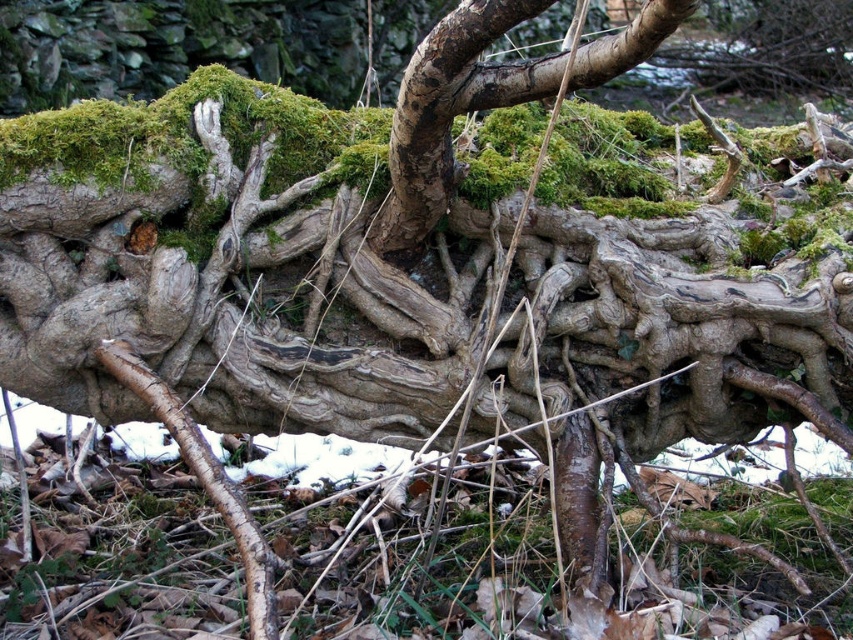
Is green mossy bark at center taller than barky brown root at lower left?

No, green mossy bark at center is not taller than barky brown root at lower left.

Measure the distance between green mossy bark at center and camera.

green mossy bark at center and camera are 1.12 meters apart.

Where is `green mossy bark at center`? green mossy bark at center is located at coordinates tap(434, 120).

What are the coordinates of `green mossy bark at center` in the screenshot? It's located at (434, 120).